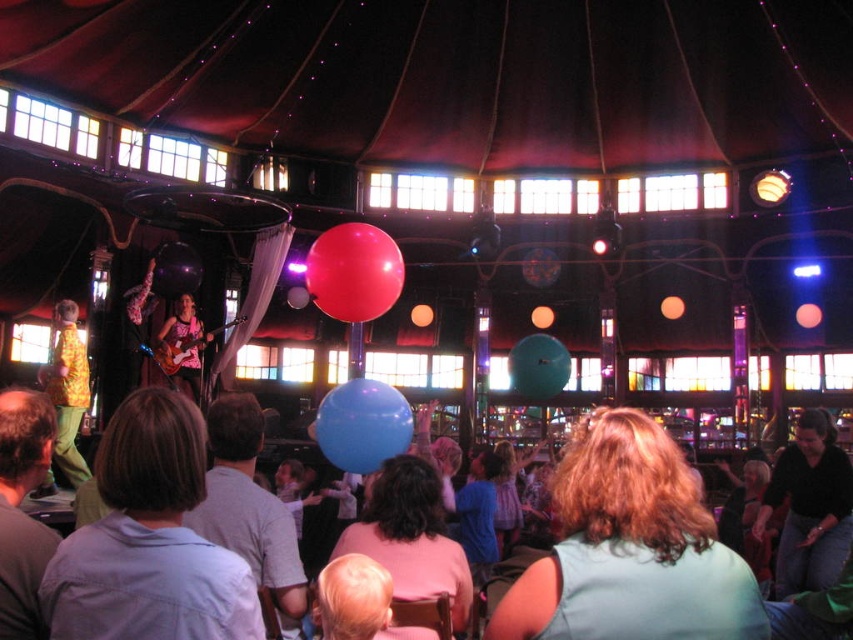
Consider the image. You are at the concert and want to take a photo of both the blue rubber balloon at center and the yellow patterned shirt at stage left. To frame them both in your camera, should you adjust your camera to the left or right?

The blue rubber balloon at center is to the right of the yellow patterned shirt at stage left. To frame both in your camera, you should adjust your camera to the left to include the yellow patterned shirt at stage left and the blue rubber balloon at center within the same frame.

You are at the concert and want to take a photo of both the black cotton shirt at lower right and the blue rubber balloon at center. Which object should you zoom in on to ensure both are clearly visible in the frame?

You should zoom in on the blue rubber balloon at center because it is smaller than the black cotton shirt at lower right, allowing both to fit within the camera frame more easily.